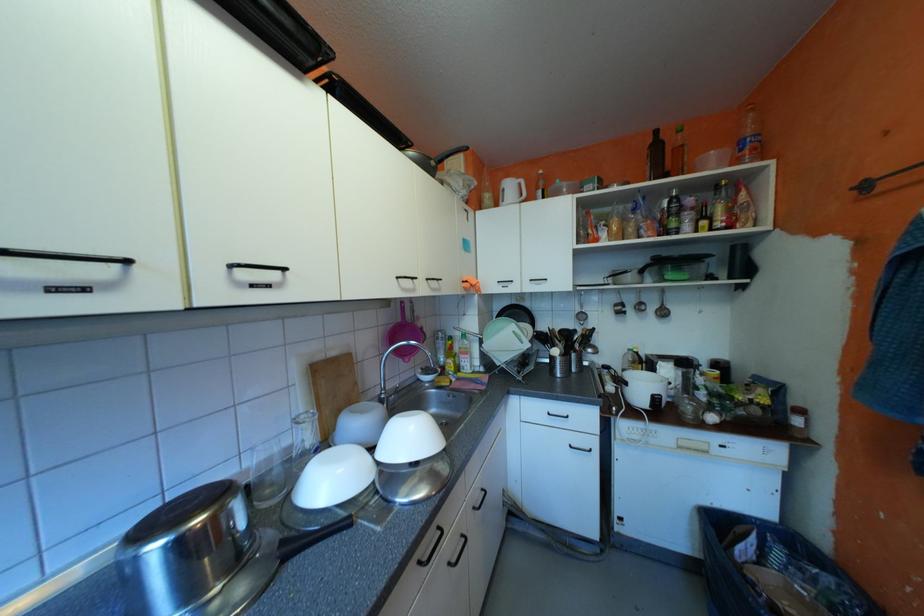
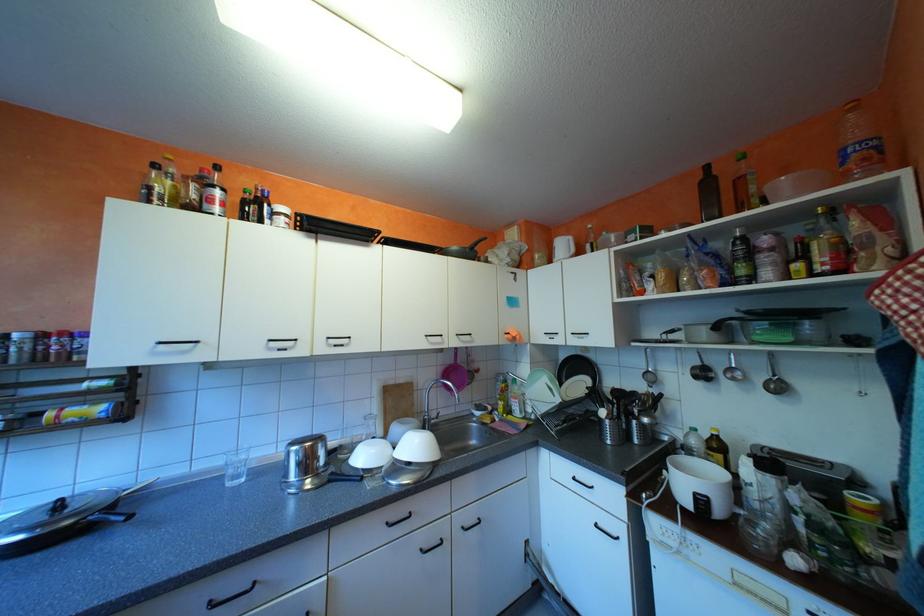
Question: The camera is either moving clockwise (left) or counter-clockwise (right) around the object. The first image is from the beginning of the video and the second image is from the end. Is the camera moving left or right when shooting the video?

Choices:
 (A) Left
 (B) Right

Answer: (B)